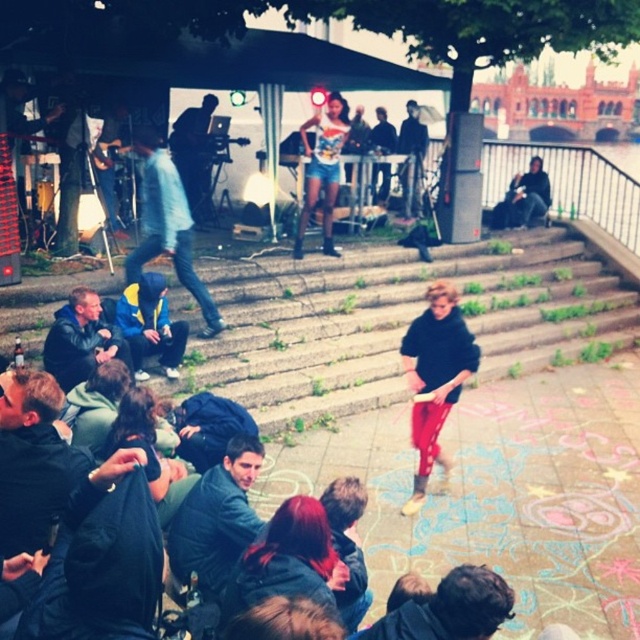
Question: Is denim jeans at center bigger than dark blue jeans at center?

Choices:
 (A) no
 (B) yes

Answer: (A)

Question: Can you confirm if denim jeans at center is positioned to the left of dark blue jeans at center?

Choices:
 (A) yes
 (B) no

Answer: (A)

Question: Is dark blue jacket at lower left bigger than dark brown hair at lower center?

Choices:
 (A) no
 (B) yes

Answer: (B)

Question: Which is nearer to the dark blue jacket at lower left?

Choices:
 (A) denim jeans at center
 (B) dark blue jeans at center
 (C) leather jacket at lower left

Answer: (C)

Question: Which of the following is the closest to the observer?

Choices:
 (A) 486,596
 (B) 408,108
 (C) 195,490

Answer: (A)

Question: Which point is farther to the camera?

Choices:
 (A) (76, 330)
 (B) (141, 262)
 (C) (467, 582)
 (D) (412, 138)

Answer: (D)